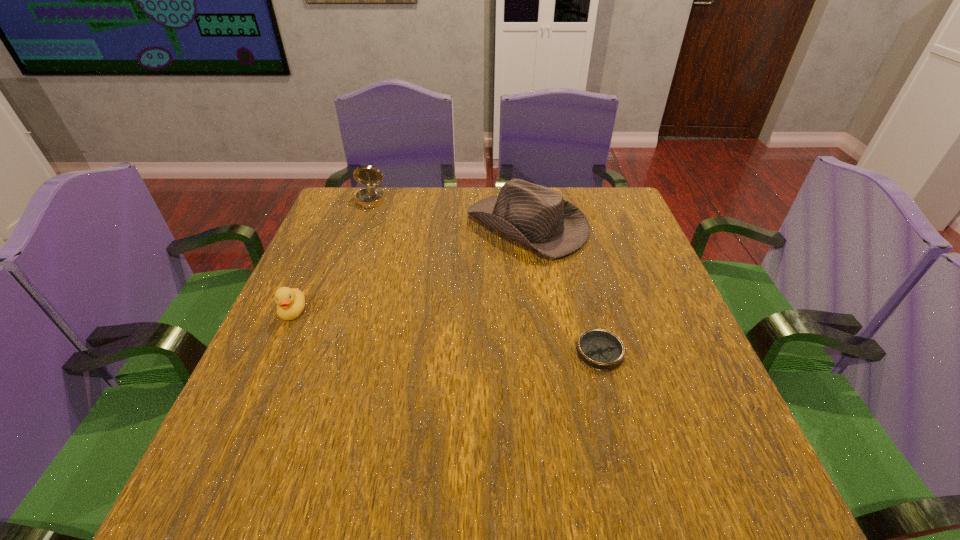
Identify the location of vacant area between the second object from left to right and the leftmost object. The width and height of the screenshot is (960, 540). (331, 257).

Where is `empty space that is in between the farther compass and the shorter compass`? The image size is (960, 540). empty space that is in between the farther compass and the shorter compass is located at coordinates (485, 277).

Find the location of a particular element. The width and height of the screenshot is (960, 540). vacant region between the nearest object and the leftmost object is located at coordinates (446, 332).

Where is `object that is the closest to the nearer compass`? object that is the closest to the nearer compass is located at coordinates (538, 218).

Point out which object is positioned as the second nearest to the shortest object. Please provide its 2D coordinates. Your answer should be formatted as a tuple, i.e. [(x, y)], where the tuple contains the x and y coordinates of a point satisfying the conditions above.

[(290, 302)]

In order to click on free point that satisfies the following two spatial constraints: 1. with the dial facing the farther compass; 2. on the right side of the fedora in this screenshot , I will do `click(361, 226)`.

Find the location of a particular element. vacant space that satisfies the following two spatial constraints: 1. with the dial facing the right compass; 2. on the right side of the second object from left to right is located at coordinates (317, 352).

This screenshot has height=540, width=960. Find the location of `free location that satisfies the following two spatial constraints: 1. on the face of the nearest object; 2. on the right side of the second shortest object`. free location that satisfies the following two spatial constraints: 1. on the face of the nearest object; 2. on the right side of the second shortest object is located at coordinates (276, 352).

Identify the location of free space that satisfies the following two spatial constraints: 1. on the face of the nearest object; 2. on the right side of the third farthest object. The width and height of the screenshot is (960, 540). (276, 352).

I want to click on vacant space that satisfies the following two spatial constraints: 1. with the dial facing the farther compass; 2. on the right side of the shortest object, so click(x=317, y=352).